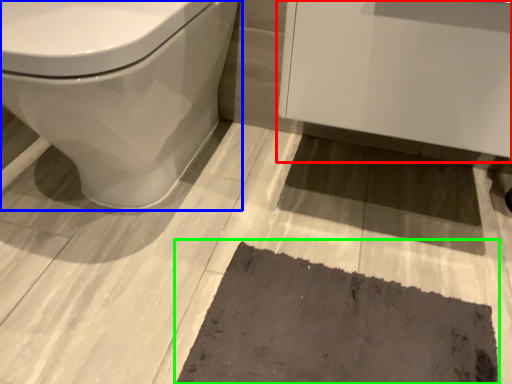
Question: Estimate the real-world distances between objects in this image. Which object is closer to porcelain (highlighted by a red box), toilet (highlighted by a blue box) or bath mat (highlighted by a green box)?

Choices:
 (A) toilet
 (B) bath mat

Answer: (A)